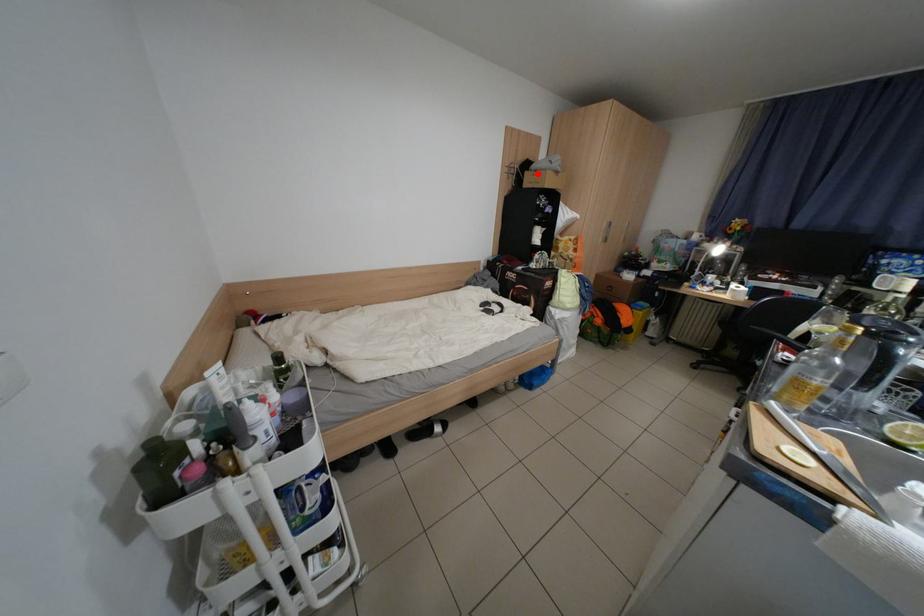
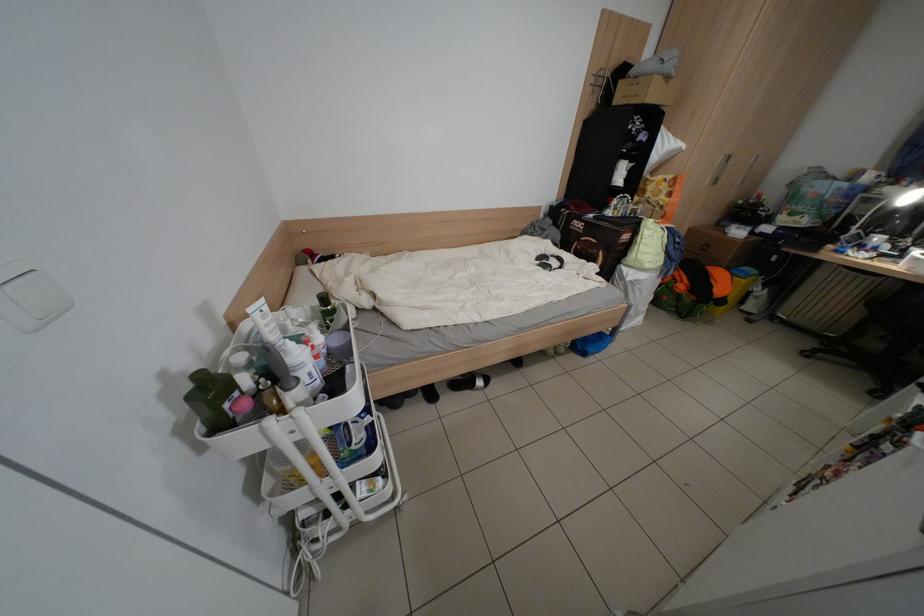
Locate, in the second image, the point that corresponds to the highlighted location in the first image.

(631, 83)